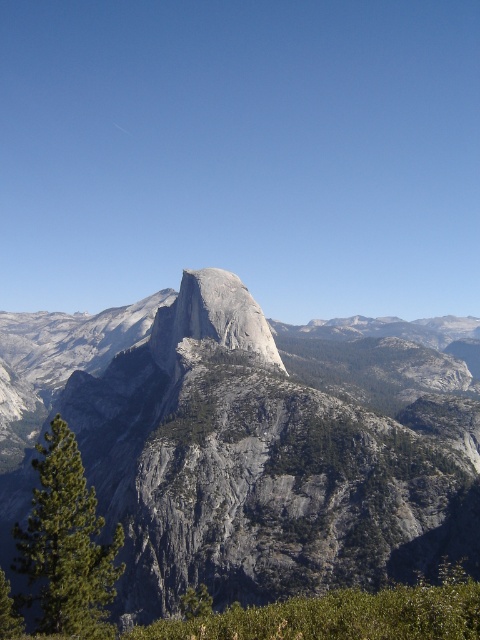
Question: Among these objects, which one is farthest from the camera?

Choices:
 (A) gray rock mountain at center
 (B) gray/granite peak at center
 (C) green textured pine tree at lower left

Answer: (B)

Question: Among these points, which one is nearest to the camera?

Choices:
 (A) (109, 589)
 (B) (204, 284)
 (C) (136, 595)

Answer: (A)

Question: Which point is farther from the camera taking this photo?

Choices:
 (A) pyautogui.click(x=60, y=470)
 (B) pyautogui.click(x=427, y=460)
 (C) pyautogui.click(x=264, y=353)

Answer: (C)

Question: Can you confirm if green textured pine tree at lower left is positioned to the left of gray/granite peak at center?

Choices:
 (A) no
 (B) yes

Answer: (B)

Question: Is gray rock mountain at center to the right of green textured pine tree at lower left from the viewer's perspective?

Choices:
 (A) no
 (B) yes

Answer: (B)

Question: Does gray rock mountain at center appear under green textured pine tree at lower left?

Choices:
 (A) no
 (B) yes

Answer: (A)